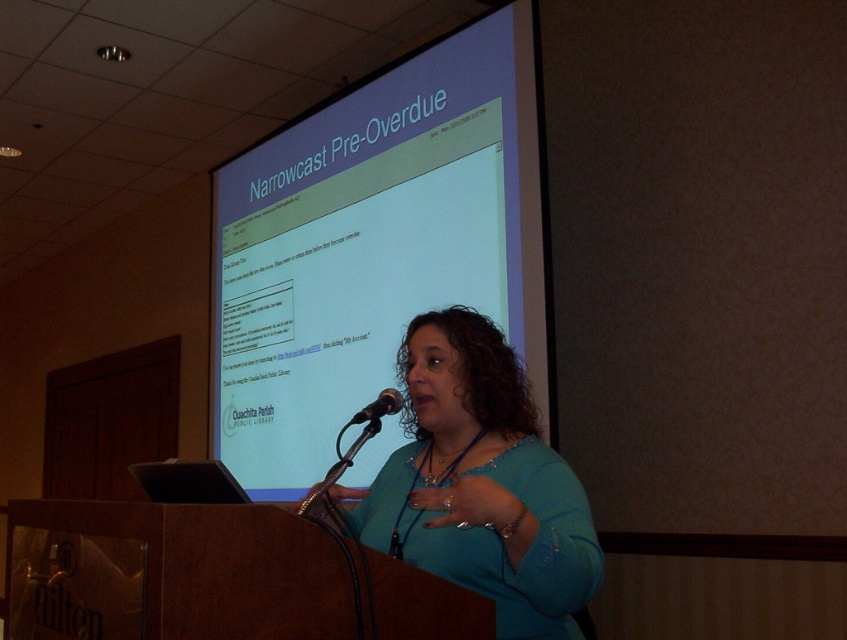
You are an attendee at the presentation and want to see both the slide and the speaker clearly. Where should you sit to ensure you can see both the matte white projector screen at upper center and the black metallic microphone at center without obstruction?

You should sit to the right side of the room because the matte white projector screen at upper center is positioned on the left side of the black metallic microphone at center. This arrangement means the screen is to the left of the microphone, so sitting to the right would provide an unobstructed view of both.

You are a stagehand setting up a microphone stand for the presenter. The microphone stand is 3.5 feet tall. You need to place it between the matte white projector screen at upper center and the teal fabric shirt at center. Can the microphone stand fit in the space between them?

The matte white projector screen at upper center is 3.96 feet away from the teal fabric shirt at center. Since the microphone stand is only 3.5 feet tall, it can fit in the space between them as the distance is greater than the stand height.

You are an attendee at the presentation. You notice the teal fabric shirt at center and the black metallic microphone at center. Which object is closer to the front of the stage?

The black metallic microphone at center is closer to the front of the stage because the teal fabric shirt at center is positioned under it, meaning the microphone is in front.